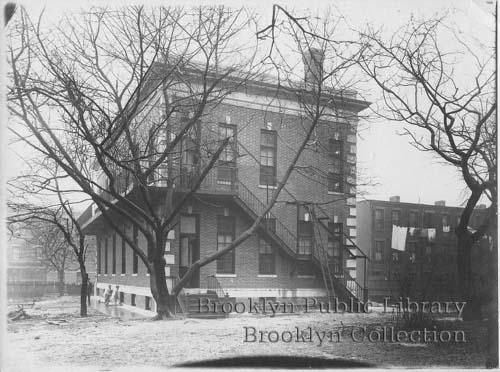
This screenshot has width=500, height=372. What are the coordinates of `doorway` in the screenshot? It's located at (189, 244).